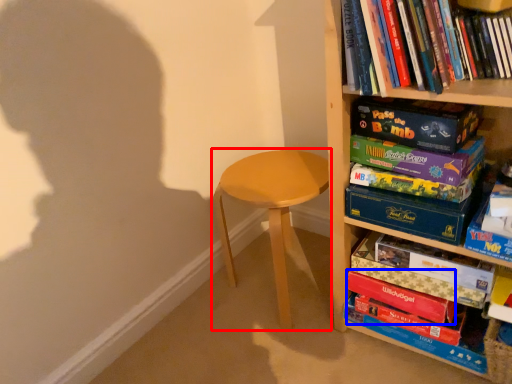
Question: Which point is further to the camera, stool (highlighted by a red box) or paperback book (highlighted by a blue box)?

Choices:
 (A) stool
 (B) paperback book

Answer: (A)